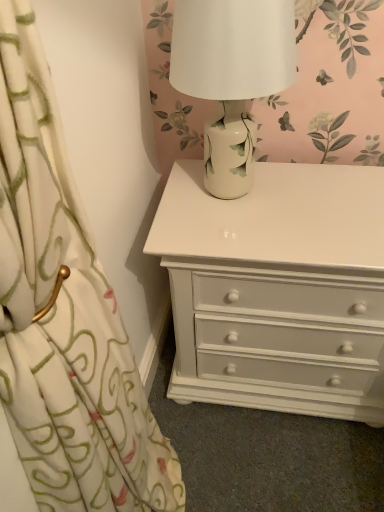
In order to face white ceramic lamp at upper center, should I rotate leftwards or rightwards?

A 5.319 degree turn to the right will do.

This screenshot has width=384, height=512. In order to click on white ceramic lamp at upper center in this screenshot , I will do `click(232, 76)`.

This screenshot has width=384, height=512. Describe the element at coordinates (232, 76) in the screenshot. I see `white ceramic lamp at upper center` at that location.

What is the approximate width of white ceramic lamp at upper center?

white ceramic lamp at upper center is 10.51 inches in width.

What are the coordinates of `white glossy chest of drawers at center` in the screenshot? It's located at (277, 288).

What do you see at coordinates (277, 288) in the screenshot?
I see `white glossy chest of drawers at center` at bounding box center [277, 288].

At what (x,y) coordinates should I click in order to perform the action: click on white ceramic lamp at upper center. Please return your answer as a coordinate pair (x, y). Looking at the image, I should click on (232, 76).

Considering the positions of objects white glossy chest of drawers at center and white ceramic lamp at upper center in the image provided, who is more to the right, white glossy chest of drawers at center or white ceramic lamp at upper center?

white glossy chest of drawers at center.

Looking at this image, is the position of white glossy chest of drawers at center less distant than that of white ceramic lamp at upper center?

No, white glossy chest of drawers at center is further to the viewer.

Does point (365, 295) come in front of point (259, 76)?

No.

In the scene shown: From the image's perspective, does white glossy chest of drawers at center appear lower than white ceramic lamp at upper center?

Correct, white glossy chest of drawers at center appears lower than white ceramic lamp at upper center in the image.

From a real-world perspective, is white glossy chest of drawers at center above or below white ceramic lamp at upper center?

From a real-world perspective, white glossy chest of drawers at center is physically below white ceramic lamp at upper center.

Can you confirm if white glossy chest of drawers at center is wider than white ceramic lamp at upper center?

Yes, white glossy chest of drawers at center is wider than white ceramic lamp at upper center.

Considering the sizes of objects white glossy chest of drawers at center and white ceramic lamp at upper center in the image provided, who is taller, white glossy chest of drawers at center or white ceramic lamp at upper center?

Standing taller between the two is white glossy chest of drawers at center.

Considering the relative sizes of white glossy chest of drawers at center and white ceramic lamp at upper center in the image provided, is white glossy chest of drawers at center bigger than white ceramic lamp at upper center?

Indeed, white glossy chest of drawers at center has a larger size compared to white ceramic lamp at upper center.

Would you say white glossy chest of drawers at center is outside white ceramic lamp at upper center?

Indeed, white glossy chest of drawers at center is completely outside white ceramic lamp at upper center.

Is white glossy chest of drawers at center with white ceramic lamp at upper center?

There is a gap between white glossy chest of drawers at center and white ceramic lamp at upper center.

Could you tell me if white glossy chest of drawers at center is turned towards white ceramic lamp at upper center?

No, white glossy chest of drawers at center is not facing towards white ceramic lamp at upper center.

Can you tell me how much white glossy chest of drawers at center and white ceramic lamp at upper center differ in facing direction?

The angular difference between white glossy chest of drawers at center and white ceramic lamp at upper center is 1.82 degrees.

How much distance is there between white glossy chest of drawers at center and white ceramic lamp at upper center?

11.62 inches.

Identify the location of table lamp in front of the white glossy chest of drawers at center. The image size is (384, 512). (232, 76).

Looking at this image, would you say white ceramic lamp at upper center is to the left or to the right of white glossy chest of drawers at center in the picture?

white ceramic lamp at upper center is to the left of white glossy chest of drawers at center.

Relative to white glossy chest of drawers at center, is white ceramic lamp at upper center in front or behind?

white ceramic lamp at upper center is in front of white glossy chest of drawers at center.

Considering the positions of points (195, 2) and (337, 244), is point (195, 2) farther from camera compared to point (337, 244)?

No, it is not.

From the image's perspective, which object appears higher, white ceramic lamp at upper center or white glossy chest of drawers at center?

From the image's view, white ceramic lamp at upper center is above.

From a real-world perspective, is white ceramic lamp at upper center beneath white glossy chest of drawers at center?

Incorrect, from a real-world perspective, white ceramic lamp at upper center is higher than white glossy chest of drawers at center.

Does white ceramic lamp at upper center have a greater width compared to white glossy chest of drawers at center?

Incorrect, the width of white ceramic lamp at upper center does not surpass that of white glossy chest of drawers at center.

Considering the relative sizes of white ceramic lamp at upper center and white glossy chest of drawers at center in the image provided, is white ceramic lamp at upper center taller than white glossy chest of drawers at center?

No, white ceramic lamp at upper center is not taller than white glossy chest of drawers at center.

Does white ceramic lamp at upper center have a larger size compared to white glossy chest of drawers at center?

Incorrect, white ceramic lamp at upper center is not larger than white glossy chest of drawers at center.

Based on the photo, can we say white ceramic lamp at upper center lies outside white glossy chest of drawers at center?

white ceramic lamp at upper center lies outside white glossy chest of drawers at center's area.

Are white ceramic lamp at upper center and white glossy chest of drawers at center making contact?

No, white ceramic lamp at upper center is not with white glossy chest of drawers at center.

Is white ceramic lamp at upper center facing away from white glossy chest of drawers at center?

white ceramic lamp at upper center does not have its back to white glossy chest of drawers at center.

How different are the orientations of white ceramic lamp at upper center and white glossy chest of drawers at center in degrees?

1.82 degrees separate the facing orientations of white ceramic lamp at upper center and white glossy chest of drawers at center.

Measure the distance from white ceramic lamp at upper center to white glossy chest of drawers at center.

white ceramic lamp at upper center and white glossy chest of drawers at center are 29.50 centimeters apart from each other.

Where is `chest of drawers on the right of white ceramic lamp at upper center`? chest of drawers on the right of white ceramic lamp at upper center is located at coordinates (277, 288).

Where is `table lamp in front of the white glossy chest of drawers at center`? This screenshot has height=512, width=384. table lamp in front of the white glossy chest of drawers at center is located at coordinates (232, 76).

Identify the location of the chest of drawers below the white ceramic lamp at upper center (from a real-world perspective). (277, 288).